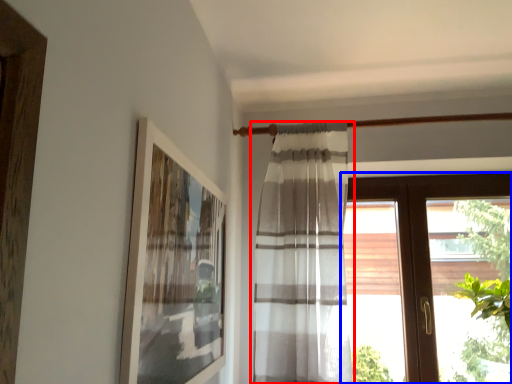
Question: Which object appears closest to the camera in this image, curtain (highlighted by a red box) or window (highlighted by a blue box)?

Choices:
 (A) curtain
 (B) window

Answer: (A)